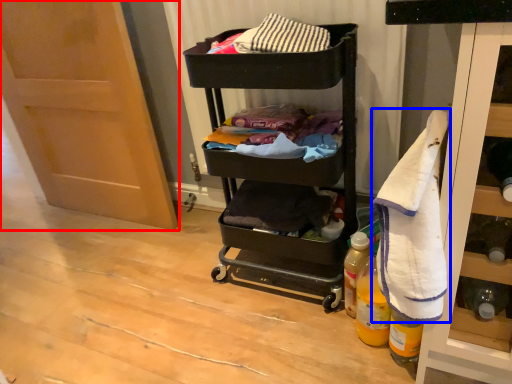
Question: Which of the following is the closest to the observer, door (highlighted by a red box) or bath towel (highlighted by a blue box)?

Choices:
 (A) door
 (B) bath towel

Answer: (B)